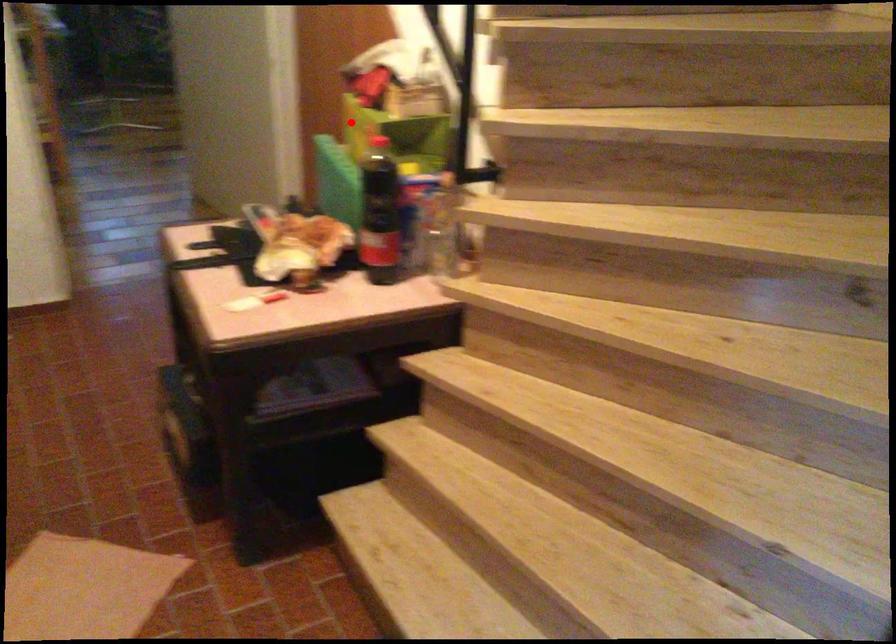
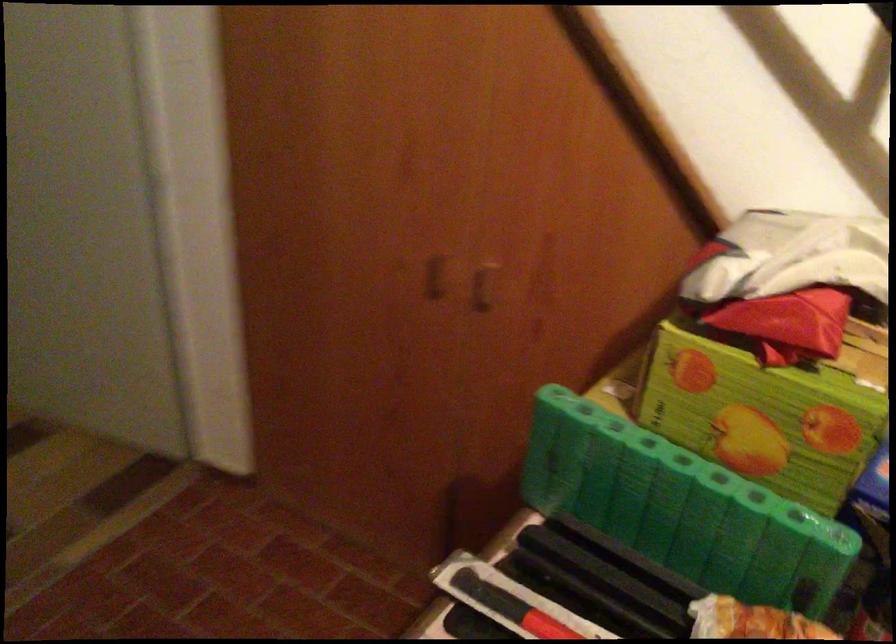
Question: A red point is marked in image1. In image2, is the corresponding 3D point closer to the camera or farther? Reply with the corresponding letter.

Choices:
 (A) The corresponding 3D point is closer.
 (B) The corresponding 3D point is farther.

Answer: (A)